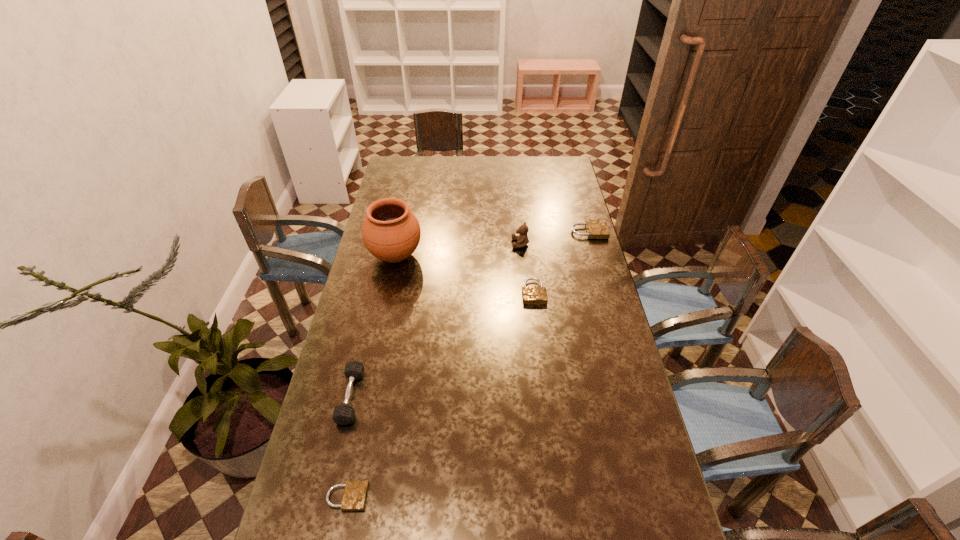
To achieve even spacing by inserting another padlock among them, please point to a vacant spot for this new padlock. Please provide its 2D coordinates. Your answer should be formatted as a tuple, i.e. [(x, y)], where the tuple contains the x and y coordinates of a point satisfying the conditions above.

[(458, 375)]